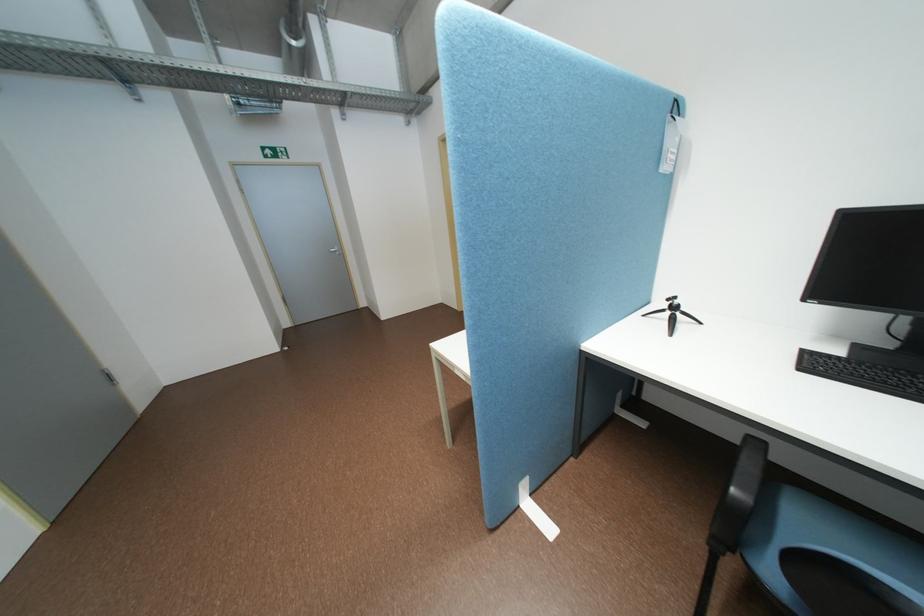
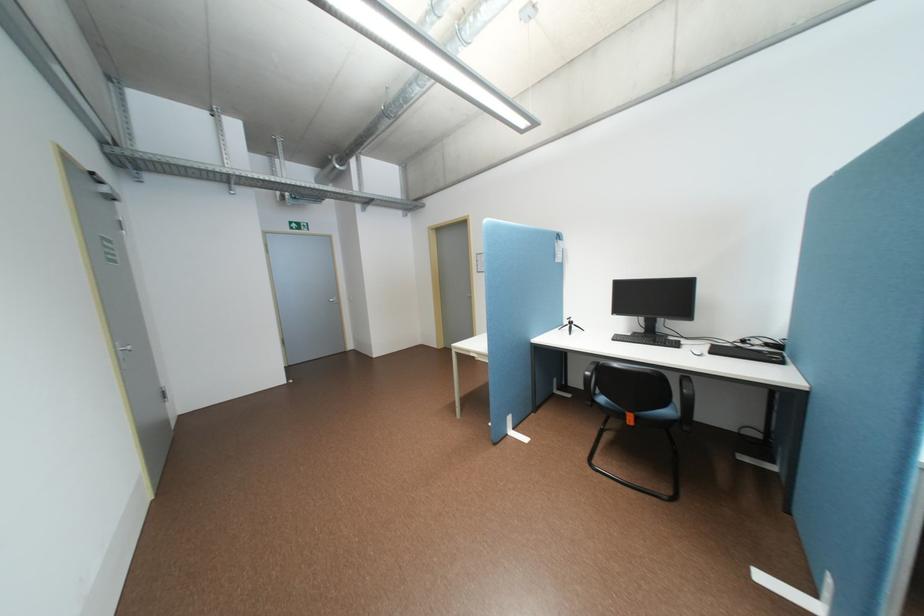
Question: I am providing you with two images of the same scene from different viewpoints. After the viewpoint changes to image2, which objects are now occluded?

Choices:
 (A) small black tripod
 (B) black computer mouse
 (C) black chair armrest
 (D) none of these

Answer: (D)